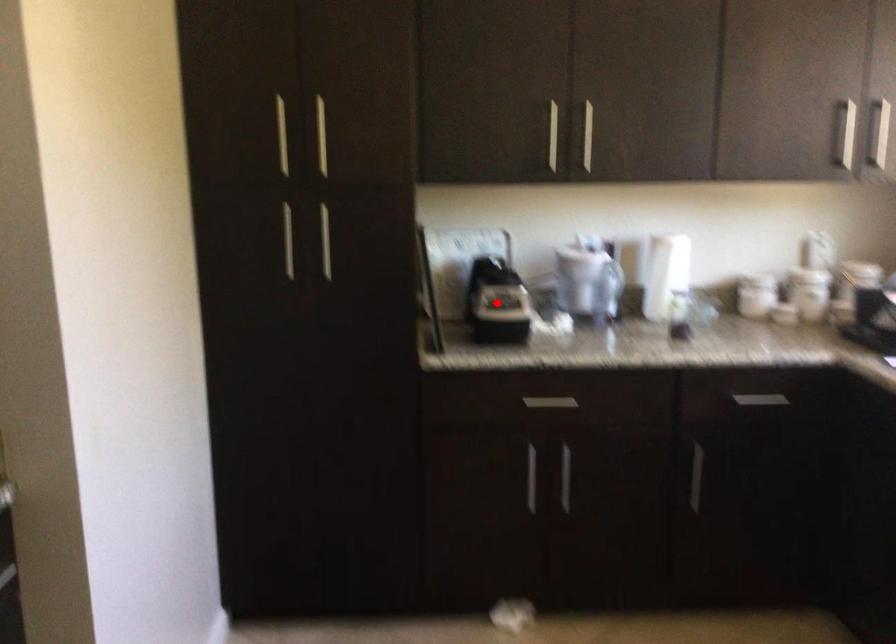
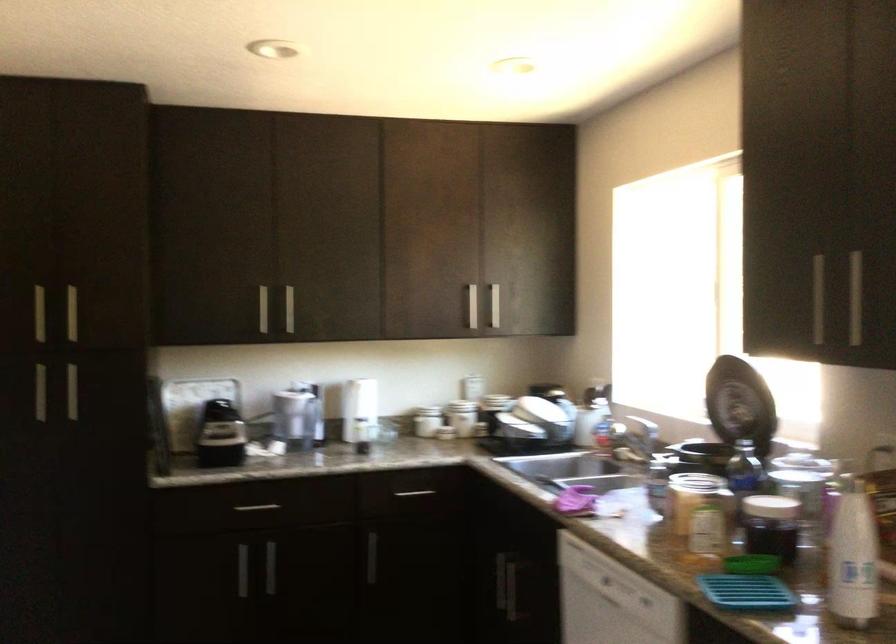
Question: I am providing you with two images of the same scene from different viewpoints. A red point is shown in image1. For the corresponding object point in image2, is it positioned nearer or farther from the camera?

Choices:
 (A) Nearer
 (B) Farther

Answer: (B)